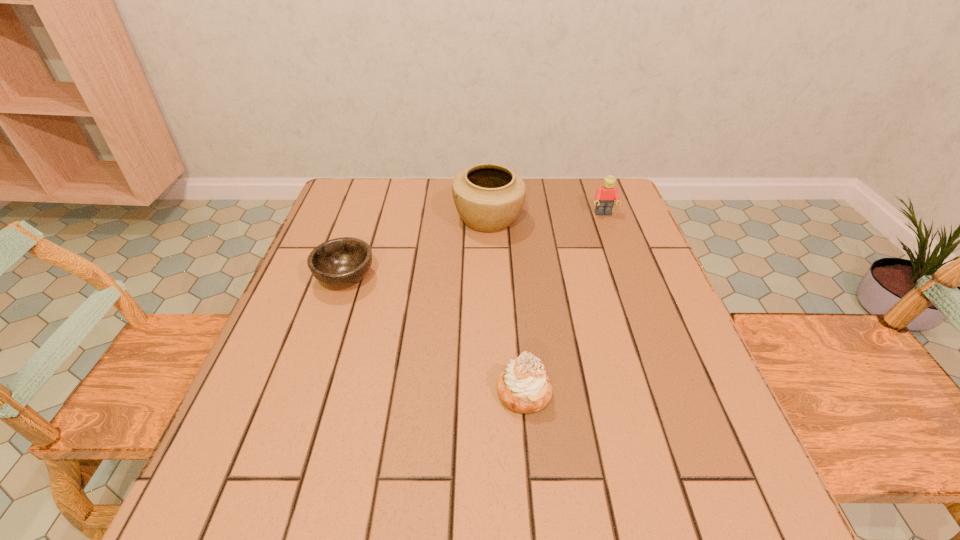
Locate an element on the screen. free space between the leftmost object and the rightmost object is located at coordinates (474, 246).

Identify the location of vacant area that lies between the second shortest object and the Lego. (564, 303).

At what (x,y) coordinates should I click in order to perform the action: click on object that is the second closest to the rightmost object. Please return your answer as a coordinate pair (x, y). This screenshot has width=960, height=540. Looking at the image, I should click on (523, 387).

This screenshot has width=960, height=540. I want to click on object that is the third nearest to the tallest object, so click(523, 387).

You are a GUI agent. You are given a task and a screenshot of the screen. Output one action in this format:
    pyautogui.click(x=<x>, y=<y>)
    Task: Click on the free space that satisfies the following two spatial constraints: 1. on the back side of the leftmost object; 2. on the left side of the tallest object
    Image resolution: width=960 pixels, height=540 pixels.
    Given the screenshot: What is the action you would take?
    pyautogui.click(x=365, y=219)

In order to click on vacant space that satisfies the following two spatial constraints: 1. on the back side of the bowl; 2. on the right side of the tallest object in this screenshot , I will do `click(365, 219)`.